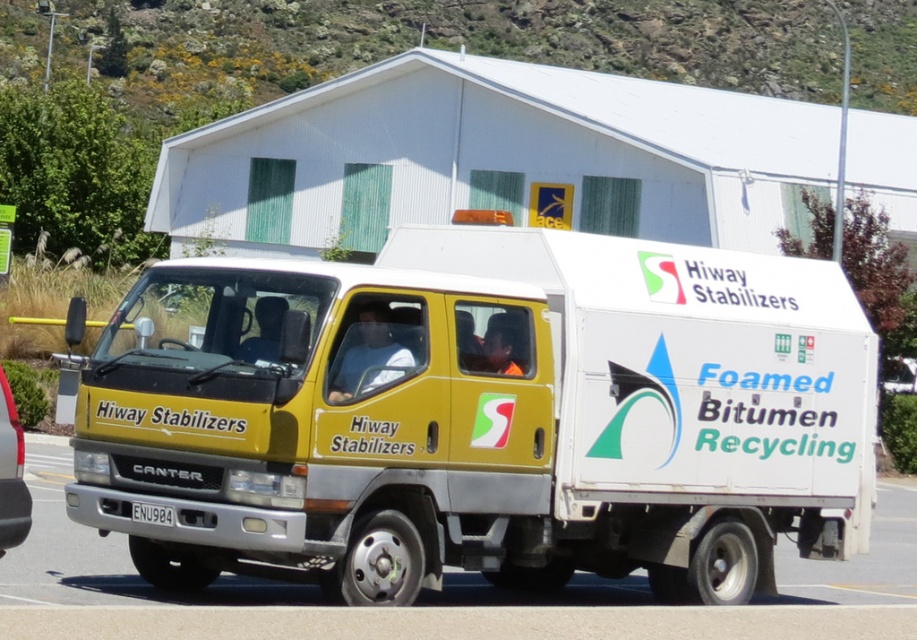
Question: Is yellow matte truck at center positioned before white plastic license plate at center?

Choices:
 (A) no
 (B) yes

Answer: (B)

Question: Which point is farther to the camera?

Choices:
 (A) (0, 369)
 (B) (224, 497)
 (C) (131, 502)

Answer: (A)

Question: Which is nearer to the white plastic license plate at center?

Choices:
 (A) matte yellow truck at center
 (B) yellow matte truck at center

Answer: (A)

Question: Is yellow matte truck at center wider than matte yellow truck at center?

Choices:
 (A) no
 (B) yes

Answer: (B)

Question: Among these points, which one is nearest to the camera?

Choices:
 (A) (666, 531)
 (B) (4, 448)

Answer: (B)

Question: In this image, where is yellow matte truck at center located relative to matte yellow truck at center?

Choices:
 (A) above
 (B) below

Answer: (B)